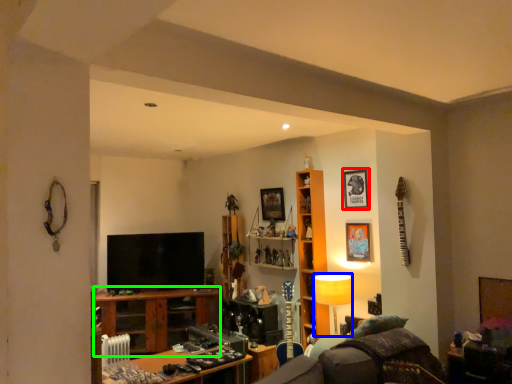
Question: Which is farther away from picture frame (highlighted by a red box)? lamp (highlighted by a blue box) or table (highlighted by a green box)?

Choices:
 (A) lamp
 (B) table

Answer: (B)